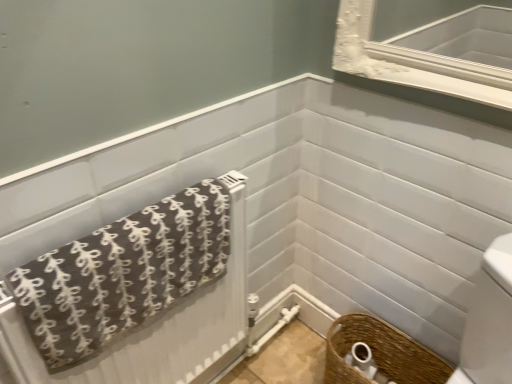
Question: Which is correct: woven brown basket at lower right is inside brown fabric towel at lower left, or outside of it?

Choices:
 (A) outside
 (B) inside

Answer: (A)

Question: Looking at the image, does woven brown basket at lower right seem bigger or smaller compared to brown fabric towel at lower left?

Choices:
 (A) big
 (B) small

Answer: (B)

Question: Which object is positioned closest to the woven brown basket at lower right?

Choices:
 (A) woven brown basket at lower right
 (B) brown fabric towel at lower left

Answer: (A)

Question: Which object is the farthest from the brown fabric towel at lower left?

Choices:
 (A) woven brown basket at lower right
 (B) woven brown basket at lower right

Answer: (A)